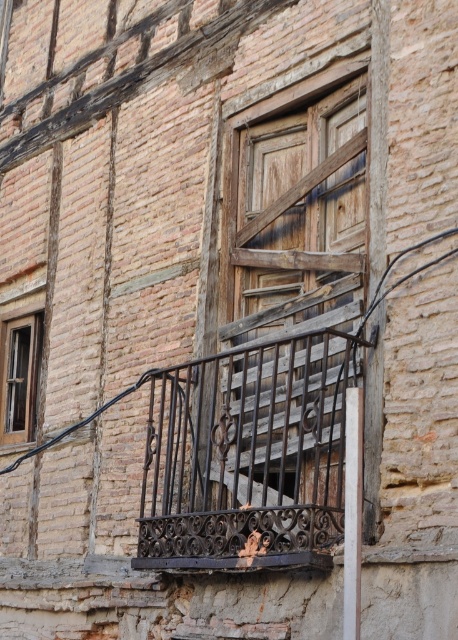
Question: Which point is farther to the camera?

Choices:
 (A) wooden window at left
 (B) rusty wrought iron balustrade at center

Answer: (A)

Question: Where is rusty wrought iron balustrade at center located in relation to wooden window at left in the image?

Choices:
 (A) left
 (B) right

Answer: (B)

Question: Is rusty wrought iron balustrade at center bigger than wooden window at left?

Choices:
 (A) yes
 (B) no

Answer: (A)

Question: Which of the following is the closest to the observer?

Choices:
 (A) rusty wrought iron balustrade at center
 (B) wooden window at left

Answer: (A)

Question: Is rusty wrought iron balustrade at center positioned before wooden window at left?

Choices:
 (A) no
 (B) yes

Answer: (B)

Question: Which point appears farthest from the camera in this image?

Choices:
 (A) (295, 493)
 (B) (23, 394)

Answer: (B)